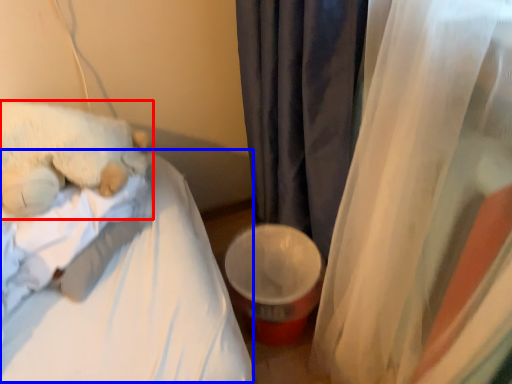
Question: Which point is closer to the camera, teddy bear (highlighted by a red box) or mattress (highlighted by a blue box)?

Choices:
 (A) teddy bear
 (B) mattress

Answer: (B)